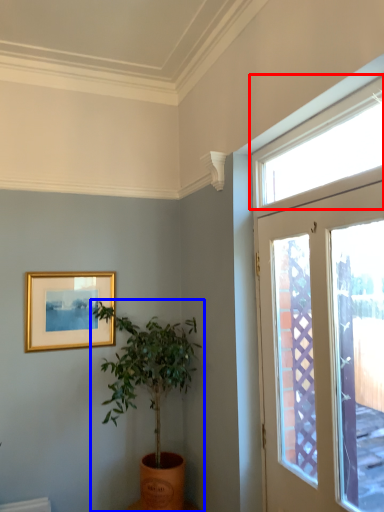
Question: Which point is closer to the camera, window (highlighted by a red box) or houseplant (highlighted by a blue box)?

Choices:
 (A) window
 (B) houseplant

Answer: (A)